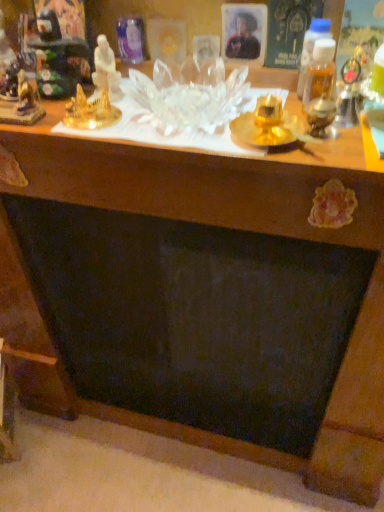
Question: Can you confirm if gold metallic statue at upper left, the 3th toy in the left-to-right sequence, is shorter than white porcelain statue at upper left, placed as the 4th toy when sorted from left to right?

Choices:
 (A) no
 (B) yes

Answer: (B)

Question: Considering the relative sizes of gold metallic statue at upper left, acting as the 2th toy starting from the right, and white porcelain statue at upper left, the 1th toy viewed from the right, in the image provided, is gold metallic statue at upper left, acting as the 2th toy starting from the right, taller than white porcelain statue at upper left, the 1th toy viewed from the right,?

Choices:
 (A) yes
 (B) no

Answer: (B)

Question: Would you say gold metallic statue at upper left, acting as the 2th toy starting from the right, is a long distance from white porcelain statue at upper left, placed as the 4th toy when sorted from left to right?

Choices:
 (A) yes
 (B) no

Answer: (B)

Question: Is white porcelain statue at upper left, the 1th toy viewed from the right, a part of gold metallic statue at upper left, the 3th toy in the left-to-right sequence?

Choices:
 (A) yes
 (B) no

Answer: (B)

Question: Considering the relative sizes of gold metallic statue at upper left, acting as the 2th toy starting from the right, and white porcelain statue at upper left, the 1th toy viewed from the right, in the image provided, is gold metallic statue at upper left, acting as the 2th toy starting from the right, bigger than white porcelain statue at upper left, the 1th toy viewed from the right,?

Choices:
 (A) yes
 (B) no

Answer: (A)

Question: Considering their positions, is transparent glass table at upper center located in front of or behind matte black portrait at upper center?

Choices:
 (A) behind
 (B) front

Answer: (B)

Question: From the image's perspective, is transparent glass table at upper center above or below matte black portrait at upper center?

Choices:
 (A) above
 (B) below

Answer: (B)

Question: Is transparent glass table at upper center spatially inside matte black portrait at upper center, or outside of it?

Choices:
 (A) outside
 (B) inside

Answer: (A)

Question: From their relative heights in the image, would you say transparent glass table at upper center is taller or shorter than matte black portrait at upper center?

Choices:
 (A) tall
 (B) short

Answer: (B)

Question: From the image's perspective, is white porcelain statue at upper left, the 1th toy viewed from the right, positioned above or below matte black portrait at upper center?

Choices:
 (A) below
 (B) above

Answer: (A)

Question: Considering the positions of white porcelain statue at upper left, the 1th toy viewed from the right, and matte black portrait at upper center in the image, is white porcelain statue at upper left, the 1th toy viewed from the right, bigger or smaller than matte black portrait at upper center?

Choices:
 (A) big
 (B) small

Answer: (A)

Question: Considering their positions, is white porcelain statue at upper left, the 1th toy viewed from the right, located in front of or behind matte black portrait at upper center?

Choices:
 (A) behind
 (B) front

Answer: (B)

Question: Is white porcelain statue at upper left, placed as the 4th toy when sorted from left to right, taller or shorter than matte black portrait at upper center?

Choices:
 (A) short
 (B) tall

Answer: (B)

Question: From a real-world perspective, is gold metallic statue at upper left, the 3th toy in the left-to-right sequence, physically located above or below transparent glass table at upper center?

Choices:
 (A) above
 (B) below

Answer: (A)

Question: Relative to transparent glass table at upper center, is gold metallic statue at upper left, acting as the 2th toy starting from the right, in front or behind?

Choices:
 (A) front
 (B) behind

Answer: (B)